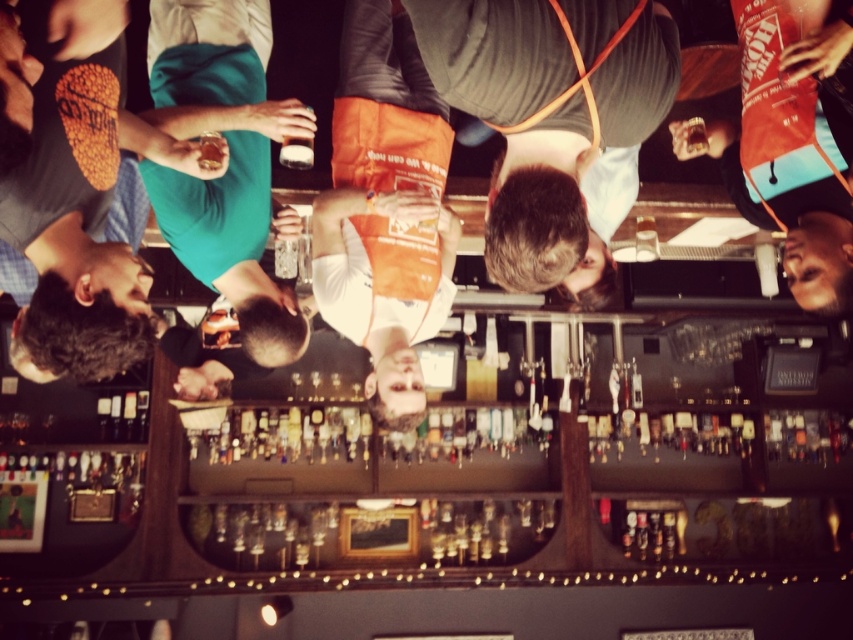
Question: Is dark gray fabric apron at center positioned behind clear glass at center?

Choices:
 (A) no
 (B) yes

Answer: (A)

Question: Which point appears farthest from the camera in this image?

Choices:
 (A) tap(492, 32)
 (B) tap(640, 225)

Answer: (B)

Question: In this image, where is dark gray fabric apron at center located relative to clear glass at center?

Choices:
 (A) left
 (B) right

Answer: (A)

Question: Where is dark gray fabric apron at center located in relation to clear glass at center in the image?

Choices:
 (A) above
 (B) below

Answer: (A)